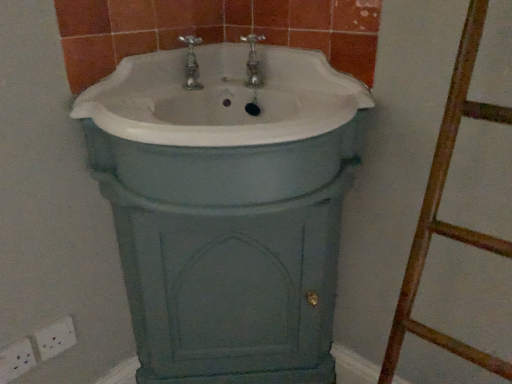
Question: Considering their positions, is white plastic electric outlet at lower left, which is the 1th electric outlet in left-to-right order, located in front of or behind white plastic electric outlet at lower left, the 1th electric outlet when ordered from right to left?

Choices:
 (A) front
 (B) behind

Answer: (A)

Question: Is white plastic electric outlet at lower left, which is the 1th electric outlet in left-to-right order, bigger or smaller than white plastic electric outlet at lower left, marked as the 2th electric outlet in a left-to-right arrangement?

Choices:
 (A) big
 (B) small

Answer: (A)

Question: Estimate the real-world distances between objects in this image. Which object is farther from the white plastic electric outlet at lower left, which is the 1th electric outlet in left-to-right order?

Choices:
 (A) white ceramic sink at center
 (B) white plastic electric outlet at lower left, marked as the 2th electric outlet in a left-to-right arrangement

Answer: (A)

Question: Which of these objects is positioned closest to the white ceramic sink at center?

Choices:
 (A) white plastic electric outlet at lower left, the 1th electric outlet when ordered from right to left
 (B) white plastic electric outlet at lower left, which is the 1th electric outlet in left-to-right order

Answer: (A)